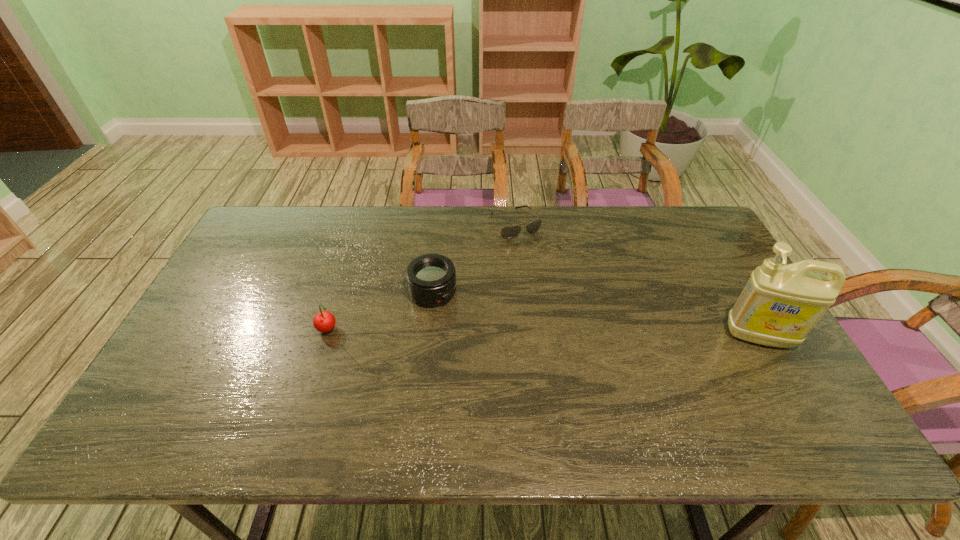
In the image, there is a desktop. Where is `blank space at the left edge`? blank space at the left edge is located at coordinates pyautogui.click(x=218, y=288).

At what (x,y) coordinates should I click in order to perform the action: click on free space at the right edge of the desktop. Please return your answer as a coordinate pair (x, y). The width and height of the screenshot is (960, 540). Looking at the image, I should click on (698, 284).

Locate an element on the screen. The image size is (960, 540). vacant position at the far left corner of the desktop is located at coordinates (252, 238).

At what (x,y) coordinates should I click in order to perform the action: click on vacant space at the far right corner of the desktop. Please return your answer as a coordinate pair (x, y). Image resolution: width=960 pixels, height=540 pixels. Looking at the image, I should click on (688, 239).

Where is `free space at the near right corner of the desktop`? free space at the near right corner of the desktop is located at coordinates (768, 382).

I want to click on free spot between the rightmost object and the cherry, so click(x=543, y=333).

Identify the location of free space between the leftmost object and the detergent. (543, 333).

You are a GUI agent. You are given a task and a screenshot of the screen. Output one action in this format:
    pyautogui.click(x=<x>, y=<y>)
    Task: Click on the unoccupied position between the detergent and the sunglasses
    
    Given the screenshot: What is the action you would take?
    pyautogui.click(x=637, y=280)

You are a GUI agent. You are given a task and a screenshot of the screen. Output one action in this format:
    pyautogui.click(x=<x>, y=<y>)
    Task: Click on the vacant area between the cherry and the third object from right to left
    
    Given the screenshot: What is the action you would take?
    pyautogui.click(x=380, y=311)

Locate an element on the screen. Image resolution: width=960 pixels, height=540 pixels. vacant point located between the sunglasses and the telephoto lens is located at coordinates (474, 258).